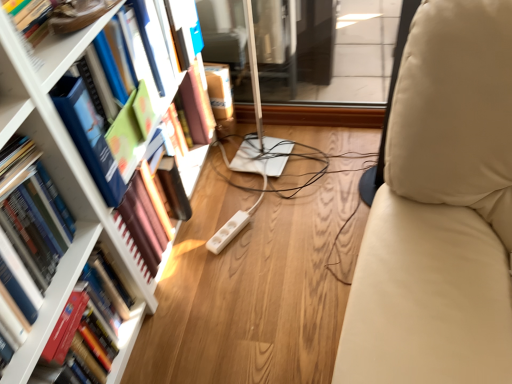
Question: Is hardcover book at left, which is the second book in top-to-bottom order, to the right of white glossy bookshelf at upper left from the viewer's perspective?

Choices:
 (A) yes
 (B) no

Answer: (B)

Question: Is there a large distance between hardcover book at left, arranged as the second book when ordered from the bottom, and white glossy bookshelf at upper left?

Choices:
 (A) no
 (B) yes

Answer: (A)

Question: Can you confirm if hardcover book at left, which is the second book in top-to-bottom order, is smaller than white glossy bookshelf at upper left?

Choices:
 (A) no
 (B) yes

Answer: (A)

Question: Is hardcover book at left, arranged as the second book when ordered from the bottom, positioned behind white glossy bookshelf at upper left?

Choices:
 (A) yes
 (B) no

Answer: (B)

Question: From the image's perspective, does hardcover book at left, which is the second book in top-to-bottom order, appear lower than white glossy bookshelf at upper left?

Choices:
 (A) no
 (B) yes

Answer: (B)

Question: From the image's perspective, is hardcover book at left, the third book from the bottom, above or below hardcover book at left, arranged as the second book when ordered from the bottom?

Choices:
 (A) above
 (B) below

Answer: (A)

Question: Is hardcover book at left, the first book viewed from the top, bigger or smaller than hardcover book at left, arranged as the second book when ordered from the bottom?

Choices:
 (A) big
 (B) small

Answer: (A)

Question: From a real-world perspective, is hardcover book at left, the first book viewed from the top, physically located above or below hardcover book at left, which is the second book in top-to-bottom order?

Choices:
 (A) below
 (B) above

Answer: (B)

Question: Looking at their shapes, would you say hardcover book at left, the first book viewed from the top, is wider or thinner than hardcover book at left, which is the second book in top-to-bottom order?

Choices:
 (A) wide
 (B) thin

Answer: (A)

Question: Is point (54, 49) positioned closer to the camera than point (81, 147)?

Choices:
 (A) closer
 (B) farther

Answer: (A)

Question: Is white glossy bookshelf at upper left taller or shorter than hardcover book at left, the third book from the bottom?

Choices:
 (A) short
 (B) tall

Answer: (A)

Question: Considering their positions, is white glossy bookshelf at upper left located in front of or behind hardcover book at left, the first book viewed from the top?

Choices:
 (A) front
 (B) behind

Answer: (A)

Question: In terms of size, does white glossy bookshelf at upper left appear bigger or smaller than hardcover book at left, the third book from the bottom?

Choices:
 (A) small
 (B) big

Answer: (A)

Question: In the image, is hardcover book at left, the first book viewed from the top, positioned in front of or behind hardcover book at left, positioned as the 1th book in bottom-to-top order?

Choices:
 (A) behind
 (B) front

Answer: (B)

Question: Considering the relative positions of hardcover book at left, the first book viewed from the top, and hardcover book at left, positioned as the 1th book in bottom-to-top order, in the image provided, is hardcover book at left, the first book viewed from the top, to the left or to the right of hardcover book at left, positioned as the 1th book in bottom-to-top order,?

Choices:
 (A) right
 (B) left

Answer: (A)